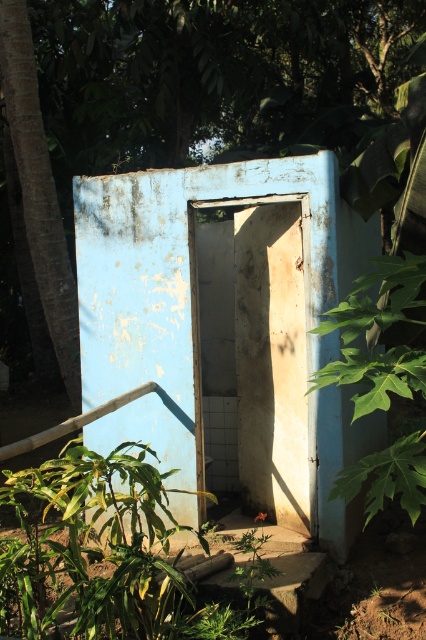
Is white matte door at center taller than green leafy plant at right?

Yes, white matte door at center is taller than green leafy plant at right.

Between white matte door at center and green leafy plant at right, which one appears on the left side from the viewer's perspective?

white matte door at center

Is point (279, 323) positioned before point (388, 378)?

No.

You are a GUI agent. You are given a task and a screenshot of the screen. Output one action in this format:
    pyautogui.click(x=<x>, y=<y>)
    Task: Click on the white matte door at center
    
    Given the screenshot: What is the action you would take?
    pyautogui.click(x=259, y=352)

Does green leafy tree at center come behind brown rough tree trunk at left?

That is True.

Is point (135, 10) positioned behind point (0, 0)?

Yes, point (135, 10) is behind point (0, 0).

What do you see at coordinates (184, 106) in the screenshot? I see `green leafy tree at center` at bounding box center [184, 106].

The height and width of the screenshot is (640, 426). Find the location of `green leafy tree at center`. green leafy tree at center is located at coordinates click(x=184, y=106).

Is green leafy tree at center taller than green leafy plant at right?

Indeed, green leafy tree at center has a greater height compared to green leafy plant at right.

The image size is (426, 640). What are the coordinates of `green leafy tree at center` in the screenshot? It's located at (184, 106).